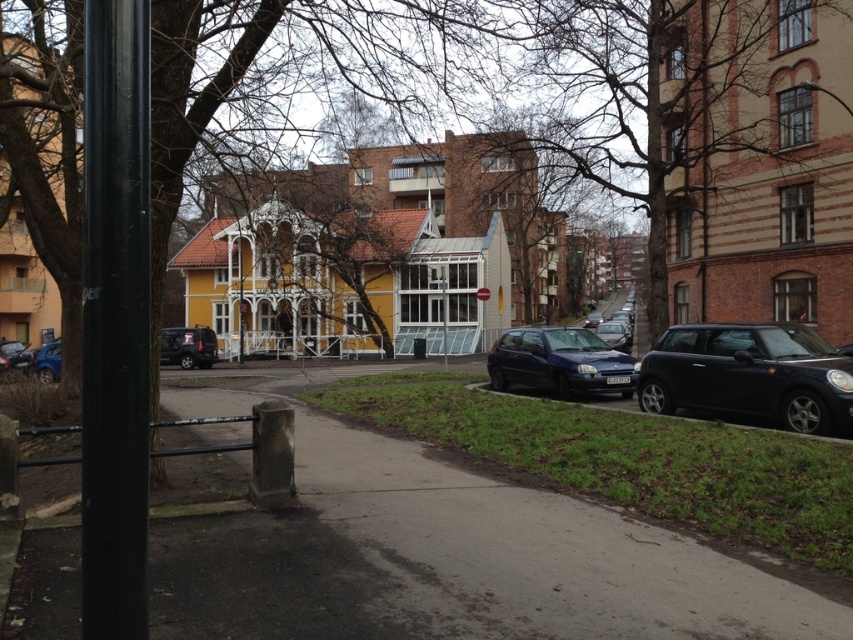
Is point (753, 392) positioned in front of point (213, 358)?

Yes, it is in front of point (213, 358).

The height and width of the screenshot is (640, 853). What do you see at coordinates (749, 374) in the screenshot?
I see `glossy black car at lower right` at bounding box center [749, 374].

This screenshot has width=853, height=640. Describe the element at coordinates (749, 374) in the screenshot. I see `glossy black car at lower right` at that location.

Identify the location of glossy black car at lower right. (749, 374).

Is glossy black car at lower right to the left of metallic blue car at lower left from the viewer's perspective?

Incorrect, glossy black car at lower right is not on the left side of metallic blue car at lower left.

Where is `glossy black car at lower right`? The image size is (853, 640). glossy black car at lower right is located at coordinates (749, 374).

In the scene shown: Can you confirm if brown textured tree at center is bigger than satin blue hatchback at center?

Yes, brown textured tree at center is bigger than satin blue hatchback at center.

Who is positioned more to the right, brown textured tree at center or satin blue hatchback at center?

Positioned to the right is satin blue hatchback at center.

Is point (96, 300) positioned behind point (486, 360)?

No, (96, 300) is in front of (486, 360).

I want to click on brown textured tree at center, so click(48, 150).